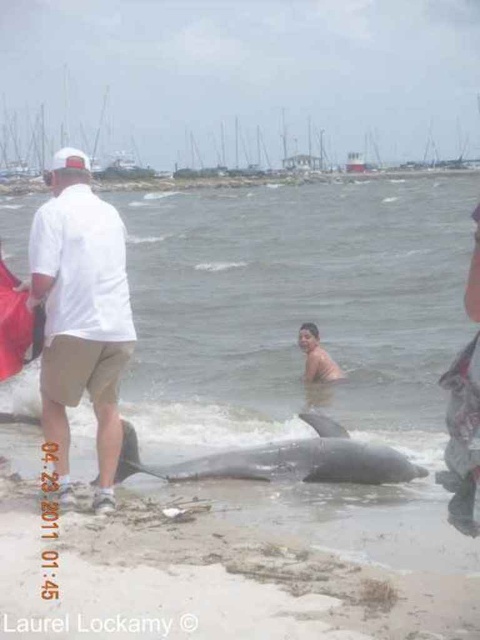
Which is more to the right, gray matte whale at center or tan skin human at center?

tan skin human at center

Does gray matte whale at center come behind tan skin human at center?

That is False.

The image size is (480, 640). Describe the element at coordinates (284, 460) in the screenshot. I see `gray matte whale at center` at that location.

You are a GUI agent. You are given a task and a screenshot of the screen. Output one action in this format:
    pyautogui.click(x=<x>, y=<y>)
    Task: Click on the gray matte whale at center
    The height and width of the screenshot is (640, 480).
    Given the screenshot: What is the action you would take?
    pyautogui.click(x=284, y=460)

Does white matte shirt at left have a lesser width compared to gray matte whale at center?

Yes.

Is white matte shirt at left positioned in front of gray matte whale at center?

Yes, it is in front of gray matte whale at center.

Is point (120, 445) more distant than point (278, 449)?

No, it is not.

Locate an element on the screen. This screenshot has width=480, height=640. white matte shirt at left is located at coordinates (81, 312).

Who is higher up, white matte shirt at left or tan skin human at center?

white matte shirt at left

Between white matte shirt at left and tan skin human at center, which one is positioned lower?

tan skin human at center is lower down.

The height and width of the screenshot is (640, 480). I want to click on white matte shirt at left, so click(81, 312).

The image size is (480, 640). I want to click on white matte shirt at left, so click(x=81, y=312).